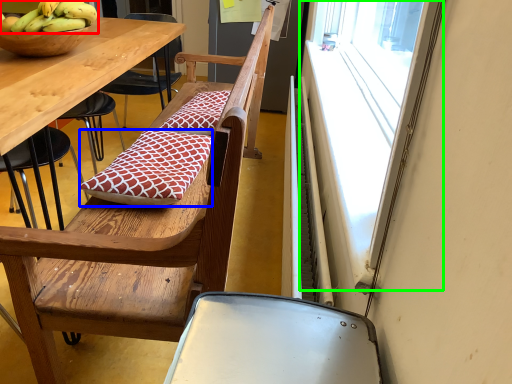
Question: Which is farther away from banana (highlighted by a red box)? pillow (highlighted by a blue box) or window (highlighted by a green box)?

Choices:
 (A) pillow
 (B) window

Answer: (B)